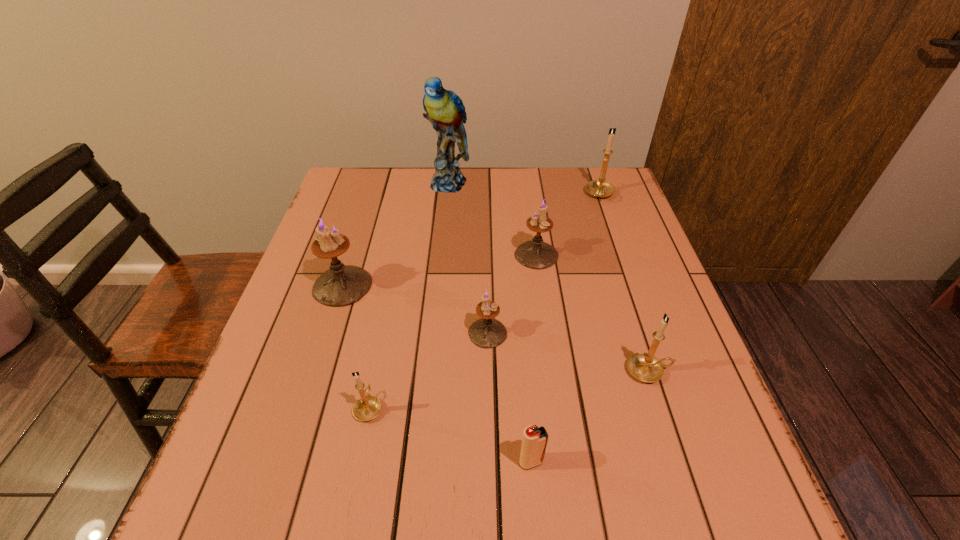
Image resolution: width=960 pixels, height=540 pixels. I want to click on vacant area that lies between the second biggest gold candle holder and the rightmost purple candle holder, so click(592, 313).

Identify the location of vacant area that lies between the second nearest gold candle holder and the farthest candle holder. (624, 283).

This screenshot has width=960, height=540. I want to click on free space that is in between the igniter and the third nearest candle holder, so click(510, 397).

Identify the location of object that can be found as the sixth closest to the smallest gold candle holder. (444, 109).

Locate which object is the sixth closest to the rightmost purple candle holder. Please provide its 2D coordinates. Your answer should be formatted as a tuple, i.e. [(x, y)], where the tuple contains the x and y coordinates of a point satisfying the conditions above.

[(366, 408)]

Locate an element on the screen. candle holder that is the fourth nearest to the fourth candle holder from right to left is located at coordinates (342, 285).

Identify which candle holder is the fourth closest to the fourth candle holder from left to right. Please provide its 2D coordinates. Your answer should be formatted as a tuple, i.e. [(x, y)], where the tuple contains the x and y coordinates of a point satisfying the conditions above.

[(342, 285)]

At what (x,y) coordinates should I click in order to perform the action: click on gold candle holder that is the second closest to the biggest purple candle holder. Please return your answer as a coordinate pair (x, y). The image size is (960, 540). Looking at the image, I should click on (645, 367).

At what (x,y) coordinates should I click in order to perform the action: click on gold candle holder that stands as the closest to the leftmost purple candle holder. Please return your answer as a coordinate pair (x, y). The width and height of the screenshot is (960, 540). Looking at the image, I should click on (366, 408).

This screenshot has height=540, width=960. In order to click on the second closest purple candle holder to the biggest purple candle holder in this screenshot , I will do `click(536, 254)`.